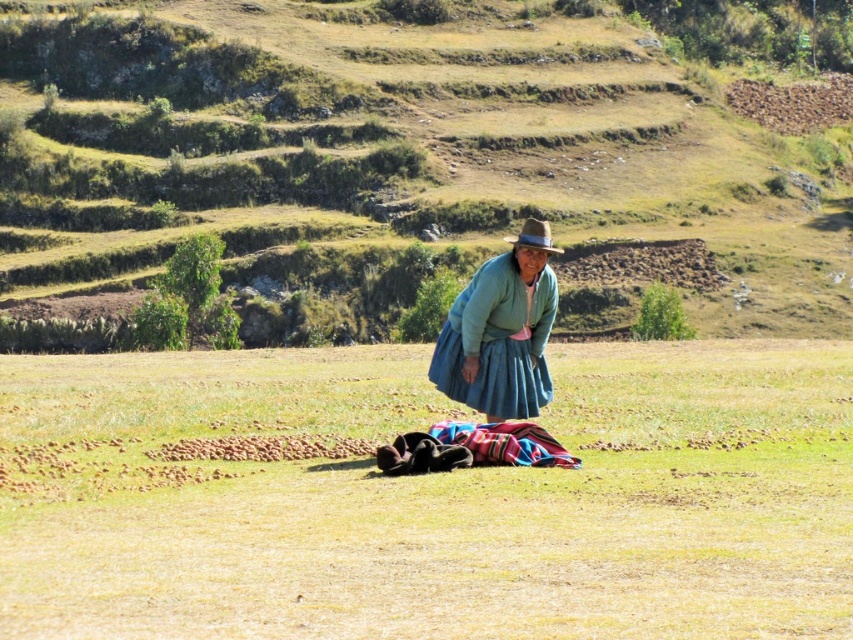
Question: Does multicolored woven cloth at center have a greater width compared to brown felt cowboy hat at center?

Choices:
 (A) no
 (B) yes

Answer: (A)

Question: Which of these objects is positioned closest to the multicolored woven cloth at center?

Choices:
 (A) blue woven skirt at center
 (B) green grass at center
 (C) green grassy hillside at center
 (D) brown felt cowboy hat at center

Answer: (A)

Question: Estimate the real-world distances between objects in this image. Which object is farther from the multicolored woven cloth at center?

Choices:
 (A) green grassy hillside at center
 (B) green grass at center
 (C) blue woven skirt at center
 (D) brown felt cowboy hat at center

Answer: (A)

Question: Is blue woven skirt at center smaller than brown felt cowboy hat at center?

Choices:
 (A) yes
 (B) no

Answer: (B)

Question: Can you confirm if green grass at center is thinner than brown felt cowboy hat at center?

Choices:
 (A) yes
 (B) no

Answer: (B)

Question: Considering the real-world distances, which object is closest to the blue woven skirt at center?

Choices:
 (A) green grassy hillside at center
 (B) multicolored woven cloth at center
 (C) brown felt cowboy hat at center
 (D) green grass at center

Answer: (C)